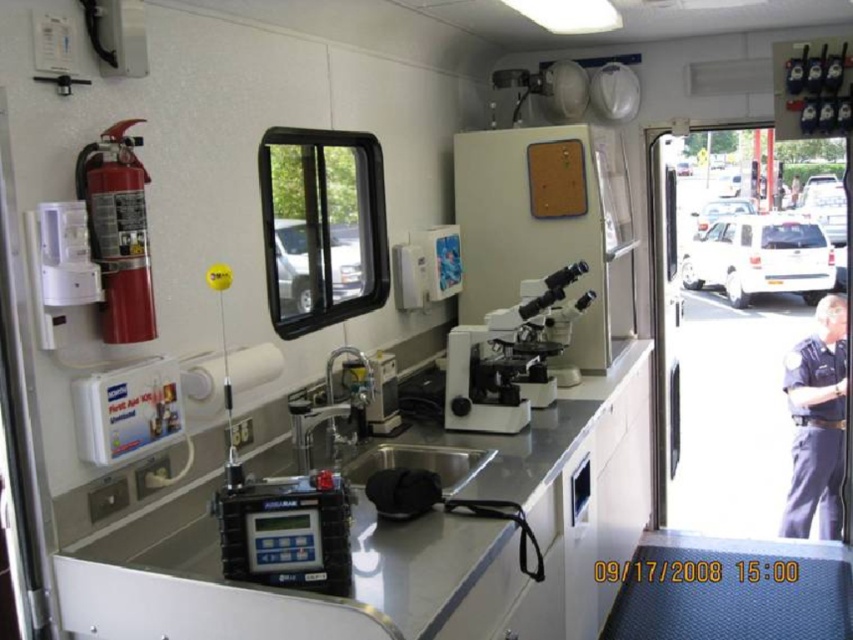
Between white plastic window at upper center and white plastic recreational vehicle at center, which one is positioned lower?

white plastic window at upper center

Is point (305, 243) positioned in front of point (733, 202)?

Yes.

The image size is (853, 640). In order to click on white plastic window at upper center in this screenshot , I will do `click(293, 266)`.

Can you confirm if dark blue uniform at right is positioned above white plastic recreational vehicle at center?

No.

Who is positioned more to the right, dark blue uniform at right or white plastic recreational vehicle at center?

white plastic recreational vehicle at center

Between point (840, 304) and point (699, 211), which one is positioned behind?

The point (699, 211) is behind.

Locate an element on the screen. This screenshot has width=853, height=640. dark blue uniform at right is located at coordinates (816, 422).

Between point (480, 353) and point (827, 198), which one is positioned behind?

The point (827, 198) is more distant.

The width and height of the screenshot is (853, 640). Identify the location of white plastic microscope at center. (509, 356).

What do you see at coordinates (509, 356) in the screenshot?
I see `white plastic microscope at center` at bounding box center [509, 356].

Image resolution: width=853 pixels, height=640 pixels. In order to click on white plastic microscope at center in this screenshot , I will do `click(509, 356)`.